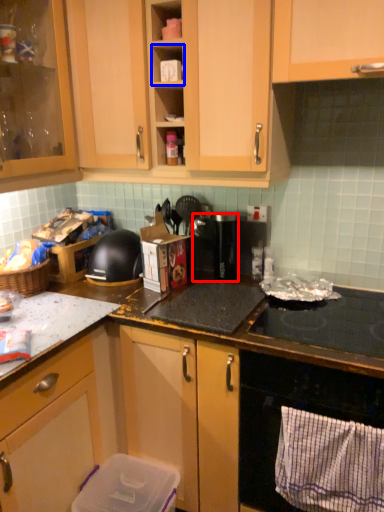
Question: Which object appears farthest to the camera in this image, appliance (highlighted by a red box) or shelf (highlighted by a blue box)?

Choices:
 (A) appliance
 (B) shelf

Answer: (A)